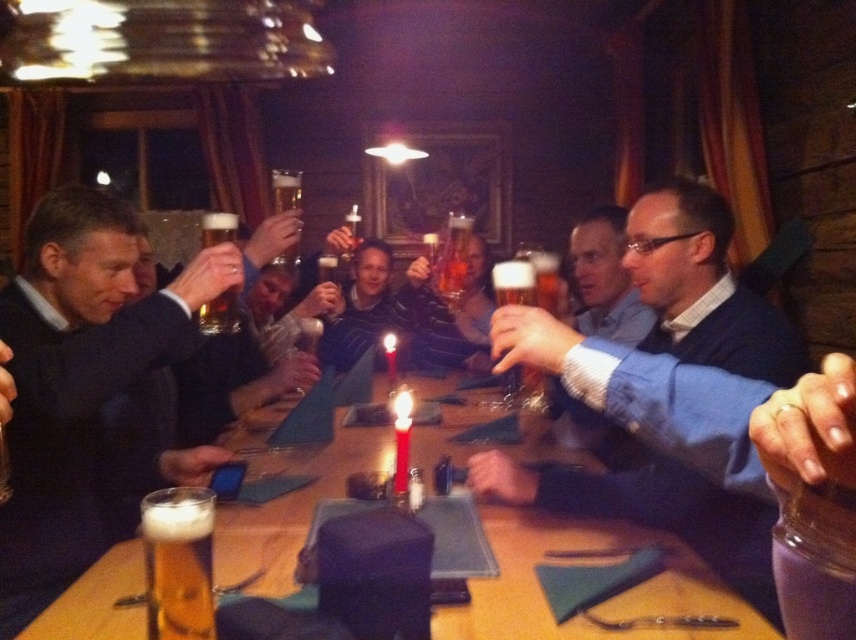
You are a photographer standing at the entrance of the restaurant. You need to take a group photo of the matte blue shirt at center and the matte black suit at left. The camera you are using has a maximum focus range of 3.5 feet. Can you capture both subjects in focus without moving either of them?

The matte blue shirt at center is 3.59 feet away from the matte black suit at left. Since the distance between them exceeds the camera maximum focus range of 3.5 feet, you cannot capture both subjects in focus without moving them.

You are a photographer standing at the back of the restaurant. You want to take a photo of the matte blue shirt at center so that it appears large and clear in the image. Based on your knowledge of photography, would you recommend moving closer to the subject or staying at your current position?

The matte blue shirt at center is currently 4.74 feet away from the camera. To make it appear larger and clearer in the photo, you should move closer to the subject, as reducing the distance will increase its size in the frame and improve clarity.

You are a customer in the restaurant and want to order a drink. The bartender tells you that the golden frothy beer at lower left is at coordinate point (177, 563). Can you locate it using the table coordinates?

The golden frothy beer at lower left is located exactly at the coordinate point (177, 563) on the table.